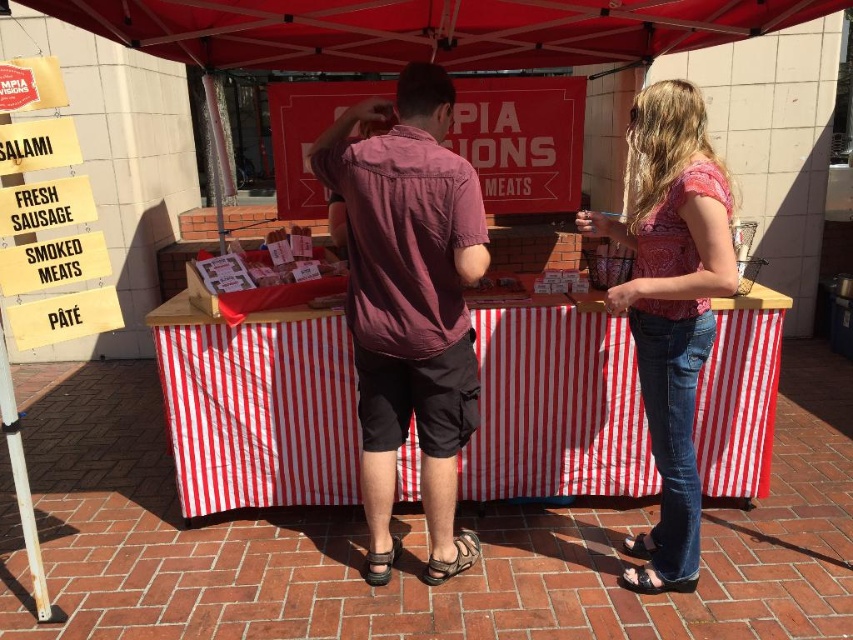
Between matte pink shirt at center and pink floral blouse at center, which one is positioned lower?

pink floral blouse at center is lower down.

Who is positioned more to the left, matte pink shirt at center or pink floral blouse at center?

matte pink shirt at center

Locate an element on the screen. Image resolution: width=853 pixels, height=640 pixels. matte pink shirt at center is located at coordinates (409, 301).

Is point (425, 113) in front of point (647, 339)?

Yes, point (425, 113) is closer to viewer.

Is point (405, 81) positioned behind point (685, 179)?

Yes, point (405, 81) is farther from viewer.

Locate an element on the screen. The width and height of the screenshot is (853, 640). maroon cotton shirt at center is located at coordinates tap(409, 304).

Does matte pink shirt at center have a greater width compared to red fabric canopy at upper center?

In fact, matte pink shirt at center might be narrower than red fabric canopy at upper center.

Who is more distant from viewer, (392, 408) or (299, 60)?

The point (299, 60) is behind.

Does point (722, 282) come behind point (506, 19)?

No, (722, 282) is closer to viewer.

Find the location of a particular element. The width and height of the screenshot is (853, 640). matte pink shirt at center is located at coordinates (409, 301).